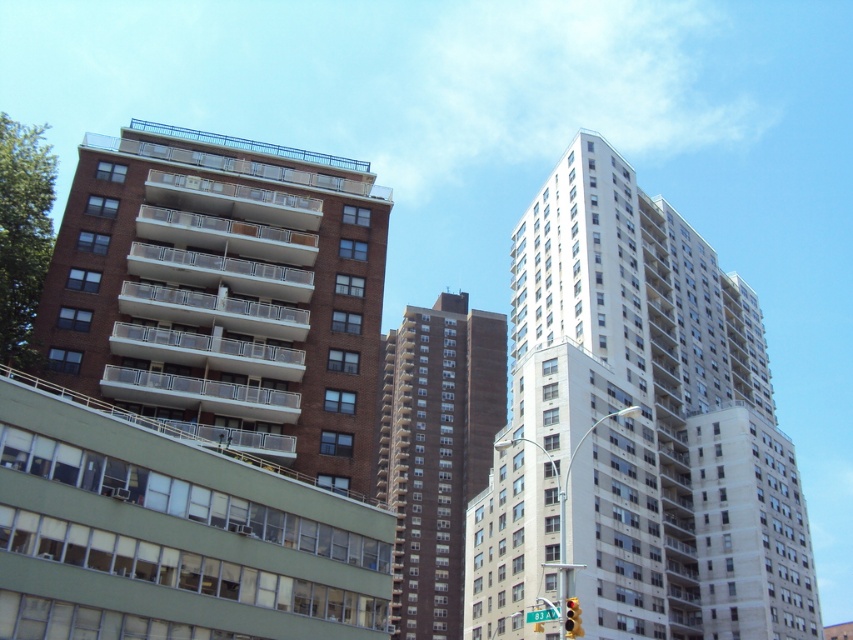
Question: Which object is closer to the camera taking this photo?

Choices:
 (A) yellow glass traffic light at center
 (B) brown brick building at center

Answer: (A)

Question: Can you confirm if brown brick building at upper left is positioned above yellow glass traffic light at center?

Choices:
 (A) no
 (B) yes

Answer: (B)

Question: Which object is closer to the camera taking this photo?

Choices:
 (A) green plastic street sign at center
 (B) brown brick building at upper left
 (C) brown brick building at center

Answer: (A)

Question: Which object is farther from the camera taking this photo?

Choices:
 (A) white smooth building at center
 (B) yellow glass traffic light at center
 (C) brown brick building at center
 (D) brown brick building at upper left

Answer: (D)

Question: Is brown brick building at center to the right of green plastic street sign at center from the viewer's perspective?

Choices:
 (A) no
 (B) yes

Answer: (A)

Question: Is yellow glass traffic light at center behind green plastic street sign at center?

Choices:
 (A) no
 (B) yes

Answer: (A)